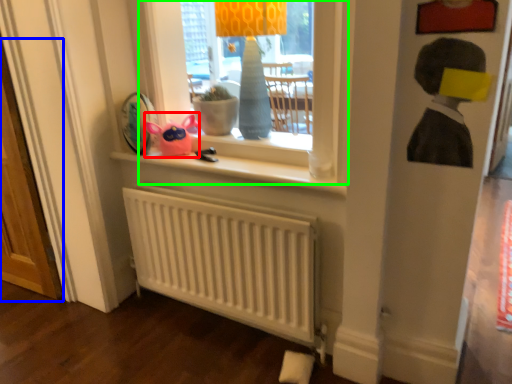
Question: Based on their relative distances, which object is nearer to toy (highlighted by a red box)? Choose from screen door (highlighted by a blue box) and window (highlighted by a green box).

Choices:
 (A) screen door
 (B) window

Answer: (B)